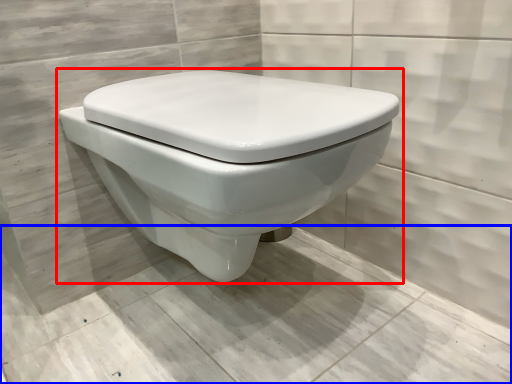
Question: Which object appears farthest to the camera in this image, toilet (highlighted by a red box) or concrete (highlighted by a blue box)?

Choices:
 (A) toilet
 (B) concrete

Answer: (A)